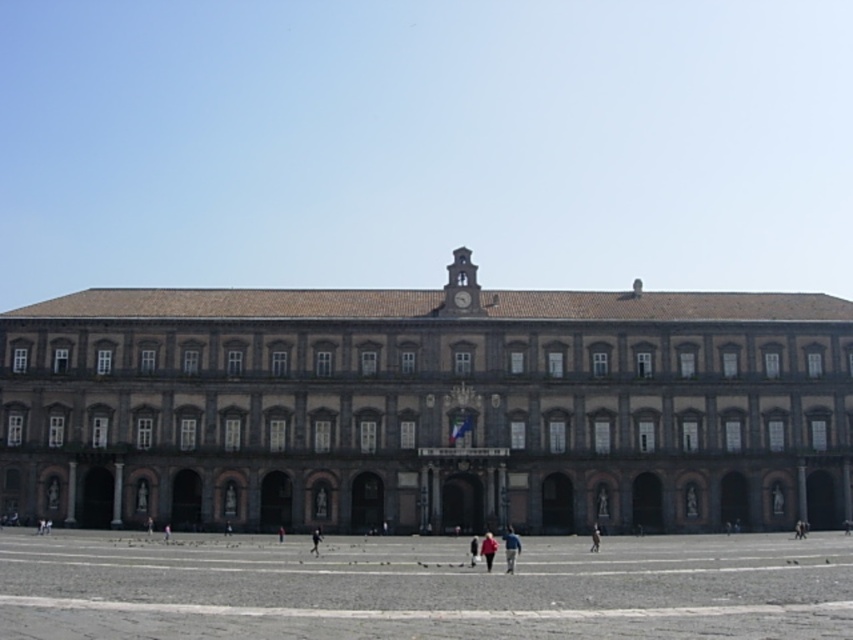
Question: Which object is closer to the camera taking this photo?

Choices:
 (A) gray stone pavement at lower center
 (B) red fabric person at center

Answer: (A)

Question: Which object is farther from the camera taking this photo?

Choices:
 (A) blue denim jeans at center
 (B) brown stone building at center
 (C) gray stone pavement at lower center

Answer: (B)

Question: Is blue denim jeans at center above red fabric person at center?

Choices:
 (A) yes
 (B) no

Answer: (B)

Question: Does brown stone building at center appear on the right side of dark blue jeans at center?

Choices:
 (A) no
 (B) yes

Answer: (A)

Question: Which of the following is the farthest from the observer?

Choices:
 (A) gray stone pavement at lower center
 (B) dark blue jeans at center

Answer: (B)

Question: Does blue denim jeans at center appear over red fabric person at center?

Choices:
 (A) no
 (B) yes

Answer: (A)